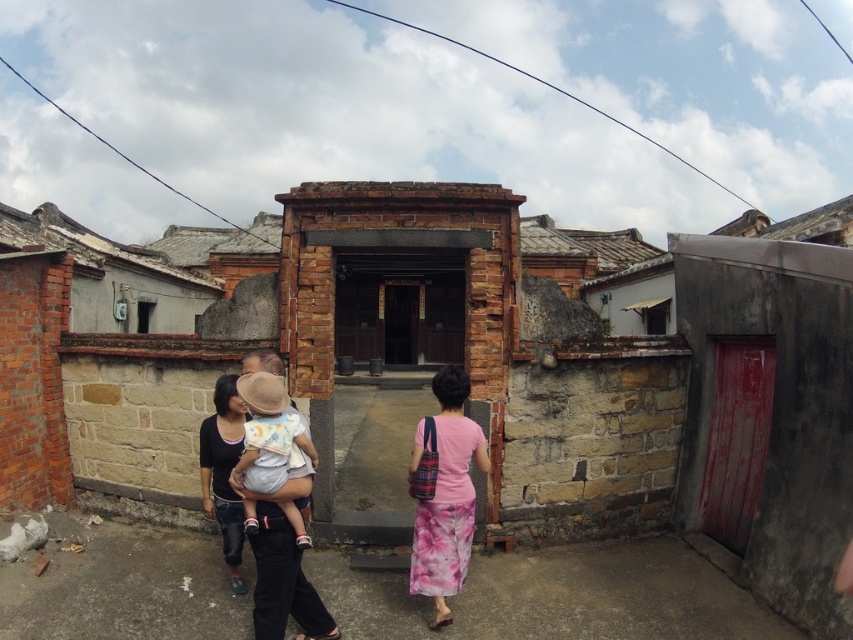
You are a tailor working in the village and need to adjust the distance between the matte black shirt at center and the pink fabric dress at center to 36 inches. Can you achieve this by moving only one of the garments?

The current distance between the matte black shirt at center and the pink fabric dress at center is 34.50 inches. To reach 36 inches, you can move either the matte black shirt at center or the pink fabric dress at center by 1.5 inches away from each other. This adjustment would achieve the desired distance without needing to move both items.

You are standing in the courtyard of the traditional Chinese village scene. You notice two points marked in the image, one at coordinates point (x=444, y=419) and another at point (x=303, y=428). From your current position, which point is closer to you?

Point (x=303, y=428) is closer to you because it is in front of point (x=444, y=419) according to the spatial arrangement.

In the scene shown: You are a photographer standing in the courtyard of a traditional Chinese village house. You see a pink fabric dress at center and a light beige cotton baby at center. Which object is located to the right of the other?

The pink fabric dress at center is positioned on the right side of light beige cotton baby at center.